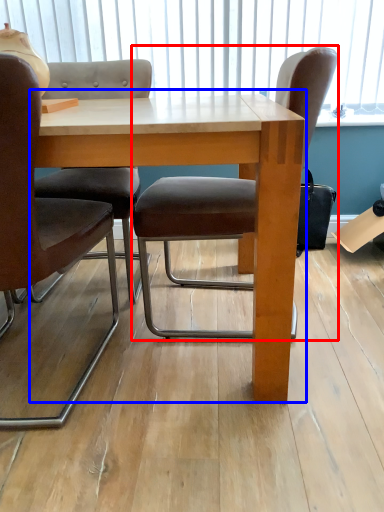
Question: Which point is closer to the camera, chair (highlighted by a red box) or table (highlighted by a blue box)?

Choices:
 (A) chair
 (B) table

Answer: (B)